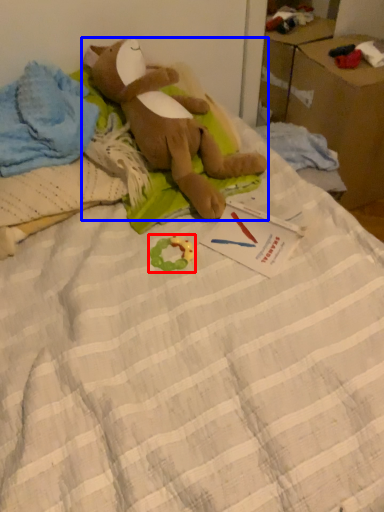
Question: Which object appears closest to the camera in this image, toy (highlighted by a red box) or toy (highlighted by a blue box)?

Choices:
 (A) toy
 (B) toy

Answer: (B)